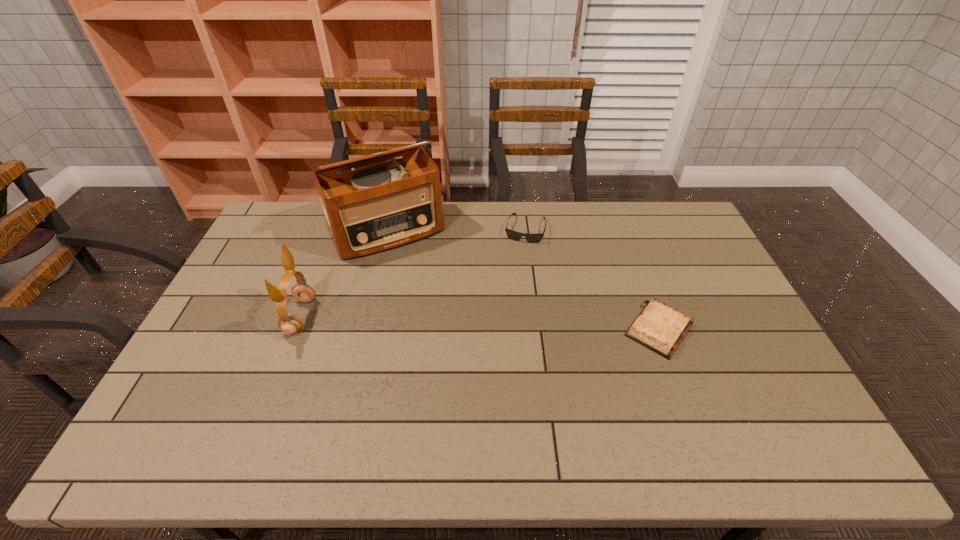
Locate an element on the screen. The image size is (960, 540). vacant spot on the desktop that is between the third shortest object and the diary and is positioned on the front-facing side of the sunglasses is located at coordinates (501, 323).

I want to click on free space on the desktop that is between the earphone and the rightmost object and is positioned on the front panel of the radio receiver, so click(439, 321).